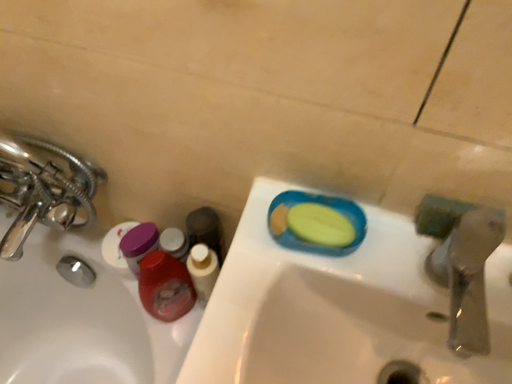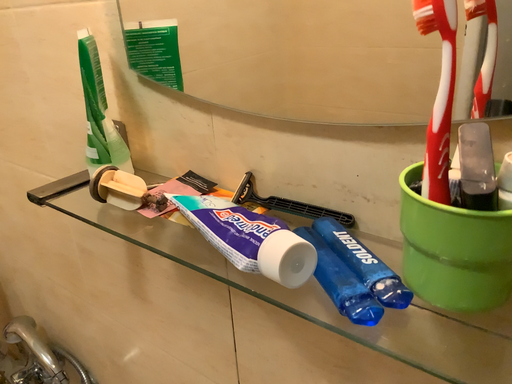
Question: How did the camera likely rotate when shooting the video?

Choices:
 (A) rotated downward
 (B) rotated upward

Answer: (B)